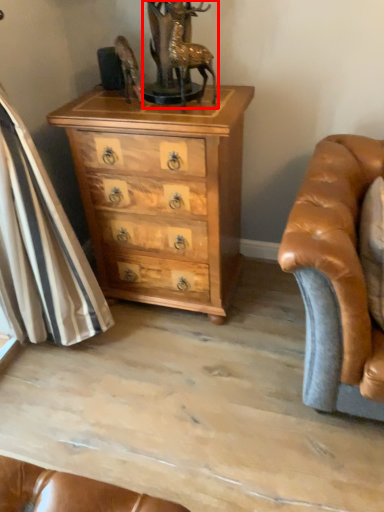
Question: From the image, what is the correct spatial relationship of antique (annotated by the red box) in relation to chest of drawers?

Choices:
 (A) left
 (B) right

Answer: (B)